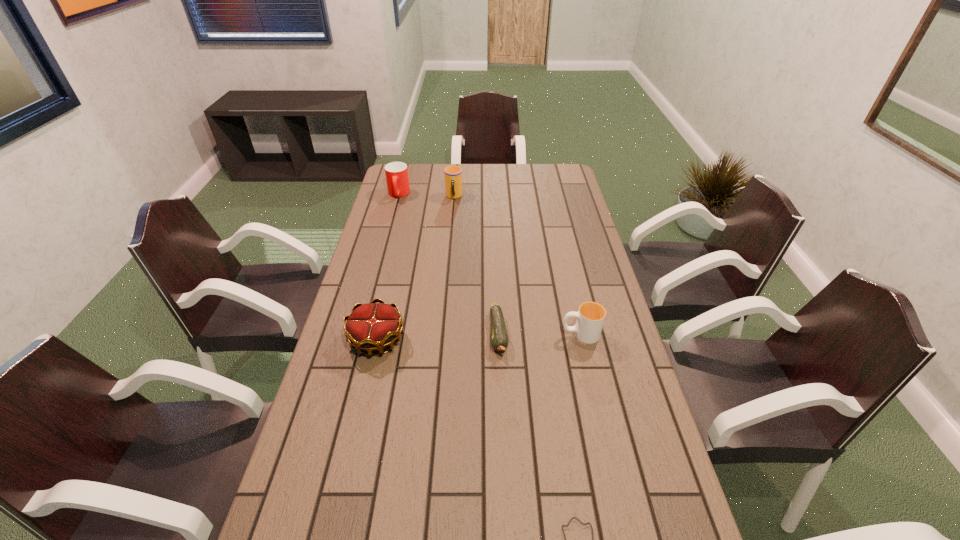
This screenshot has height=540, width=960. In the image, there is a desktop. Find the location of `vacant space at the far left corner`. vacant space at the far left corner is located at coordinates (421, 175).

Where is `blank region between the crown and the fourth object from right to left`? The height and width of the screenshot is (540, 960). blank region between the crown and the fourth object from right to left is located at coordinates (416, 268).

The width and height of the screenshot is (960, 540). In order to click on vacant point located between the leftmost cup and the third object from left to right in this screenshot , I will do `click(426, 195)`.

In order to click on vacant area that lies between the zucchini and the fourth object from right to left in this screenshot , I will do `click(476, 265)`.

Find the location of a particular element. empty space that is in between the leftmost cup and the rightmost cup is located at coordinates (490, 264).

You are a GUI agent. You are given a task and a screenshot of the screen. Output one action in this format:
    pyautogui.click(x=<x>, y=<y>)
    Task: Click on the free space between the second cup from right to left and the leftmost cup
    The width and height of the screenshot is (960, 540).
    Given the screenshot: What is the action you would take?
    (426, 195)

Locate an element on the screen. empty space between the fourth object from right to left and the crown is located at coordinates (416, 268).

This screenshot has height=540, width=960. Identify the location of vacant area between the crown and the leftmost cup. (388, 267).

You are a GUI agent. You are given a task and a screenshot of the screen. Output one action in this format:
    pyautogui.click(x=<x>, y=<y>)
    Task: Click on the free space between the shortest object and the shortest cup
    
    Given the screenshot: What is the action you would take?
    pyautogui.click(x=540, y=334)

Select which object appears as the fifth closest to the zucchini. Please provide its 2D coordinates. Your answer should be formatted as a tuple, i.e. [(x, y)], where the tuple contains the x and y coordinates of a point satisfying the conditions above.

[(397, 179)]